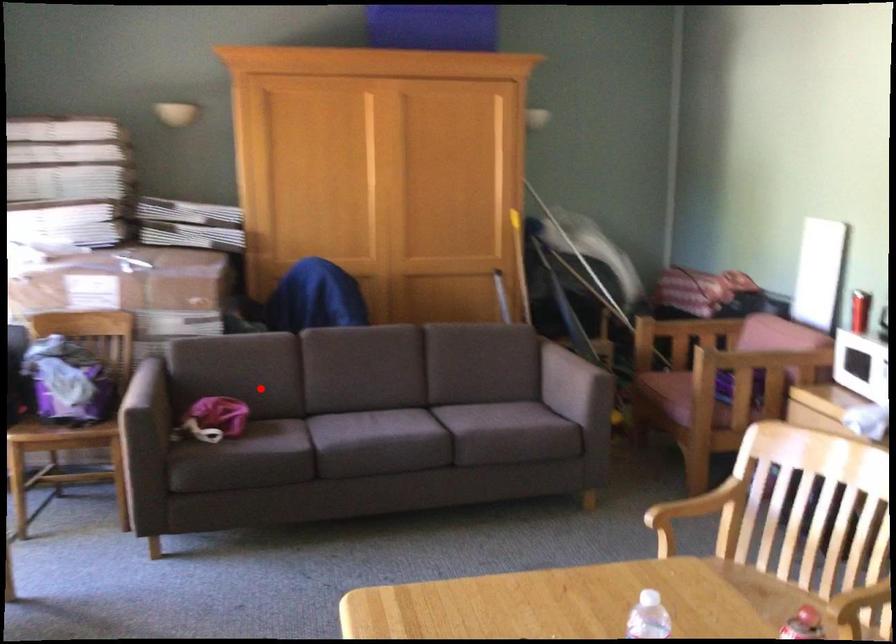
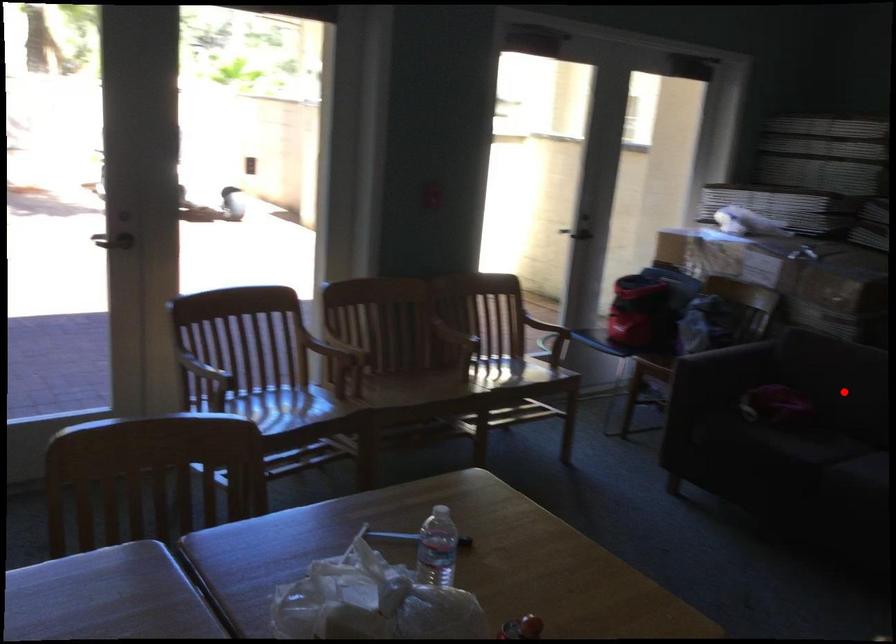
I am providing you with two images of the same scene from different viewpoints. A red point is marked on the first image and another point is marked on the second image. Is the marked point in image1 the same physical position as the marked point in image2?

Yes